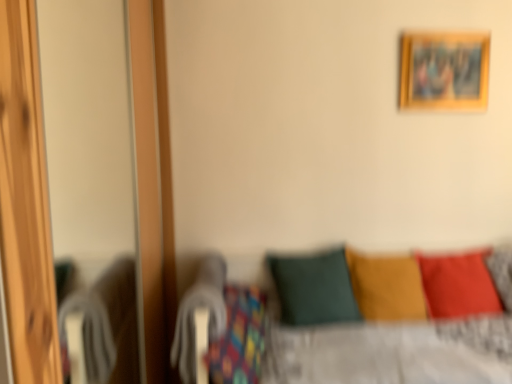
Question: Would you say matte red pillow at lower right, positioned as the 3th pillow in left-to-right order, is inside or outside dark green fabric pillow at center, marked as the 1th pillow in a left-to-right arrangement?

Choices:
 (A) inside
 (B) outside

Answer: (B)

Question: From the image's perspective, is matte red pillow at lower right, which appears as the 1th pillow when viewed from the right, located above or below dark green fabric pillow at center, placed as the 3th pillow when sorted from right to left?

Choices:
 (A) below
 (B) above

Answer: (B)

Question: Considering the real-world distances, which object is closest to the wooden screen door at left?

Choices:
 (A) wooden picture frame at upper right
 (B) velvet yellow pillow at center, which is the second pillow in right-to-left order
 (C) dark green fabric pillow at center, placed as the 3th pillow when sorted from right to left
 (D) matte red pillow at lower right, which appears as the 1th pillow when viewed from the right

Answer: (C)

Question: Estimate the real-world distances between objects in this image. Which object is closer to the velvet yellow pillow at center, which is the second pillow in right-to-left order?

Choices:
 (A) matte red pillow at lower right, which appears as the 1th pillow when viewed from the right
 (B) wooden picture frame at upper right
 (C) dark green fabric pillow at center, placed as the 3th pillow when sorted from right to left
 (D) wooden screen door at left

Answer: (C)